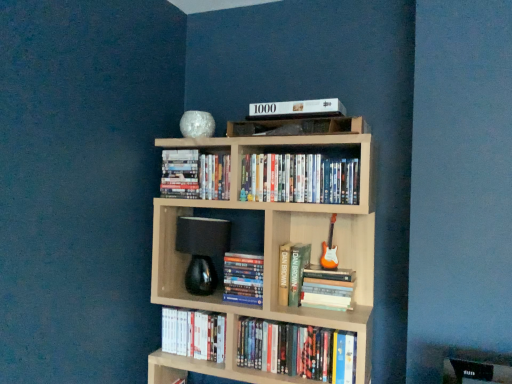
Question: Considering the relative positions of white matte book at upper center, which is counted as the first book, starting from the top, and hardcover book at center, acting as the fifth book starting from the top, in the image provided, is white matte book at upper center, which is counted as the first book, starting from the top, in front of hardcover book at center, acting as the fifth book starting from the top,?

Choices:
 (A) yes
 (B) no

Answer: (A)

Question: Is white matte book at upper center, which is counted as the first book, starting from the top, smaller than hardcover book at center, which ranks as the 4th book in bottom-to-top order?

Choices:
 (A) no
 (B) yes

Answer: (B)

Question: Does white matte book at upper center, which is counted as the first book, starting from the top, have a lesser width compared to hardcover book at center, which ranks as the 4th book in bottom-to-top order?

Choices:
 (A) no
 (B) yes

Answer: (A)

Question: From the image's perspective, does white matte book at upper center, which is counted as the first book, starting from the top, appear higher than hardcover book at center, which ranks as the 4th book in bottom-to-top order?

Choices:
 (A) yes
 (B) no

Answer: (A)

Question: Is white matte book at upper center, which is counted as the first book, starting from the top, bigger than hardcover book at center, acting as the fifth book starting from the top?

Choices:
 (A) yes
 (B) no

Answer: (B)

Question: Is white matte book at upper center, the eighth book ordered from the bottom, at the right side of hardcover book at center, which ranks as the 4th book in bottom-to-top order?

Choices:
 (A) no
 (B) yes

Answer: (B)

Question: Would you say hardcover book at center, the 4th book positioned from the top, is outside matte plastic dvds at upper center, which ranks as the 6th book in bottom-to-top order?

Choices:
 (A) no
 (B) yes

Answer: (B)

Question: Considering the relative sizes of hardcover book at center, the 4th book positioned from the top, and matte plastic dvds at upper center, which ranks as the 6th book in bottom-to-top order, in the image provided, is hardcover book at center, the 4th book positioned from the top, smaller than matte plastic dvds at upper center, which ranks as the 6th book in bottom-to-top order,?

Choices:
 (A) yes
 (B) no

Answer: (A)

Question: From a real-world perspective, is hardcover book at center, positioned as the fifth book in bottom-to-top order, beneath matte plastic dvds at upper center, which ranks as the 6th book in bottom-to-top order?

Choices:
 (A) no
 (B) yes

Answer: (B)

Question: Can you confirm if hardcover book at center, the 4th book positioned from the top, is positioned to the left of matte plastic dvds at upper center, which ranks as the 6th book in bottom-to-top order?

Choices:
 (A) yes
 (B) no

Answer: (A)

Question: From the image's perspective, is hardcover book at center, positioned as the fifth book in bottom-to-top order, over matte plastic dvds at upper center, which ranks as the 6th book in bottom-to-top order?

Choices:
 (A) yes
 (B) no

Answer: (B)

Question: Can you see hardcover book at center, the 4th book positioned from the top, touching matte plastic dvds at upper center, arranged as the 3th book when viewed from the top?

Choices:
 (A) yes
 (B) no

Answer: (B)

Question: Is hardcover book at center, the sixth book positioned from the top, to the right of hardcover books at lower center, marked as the eighth book in a top-to-bottom arrangement, from the viewer's perspective?

Choices:
 (A) no
 (B) yes

Answer: (B)